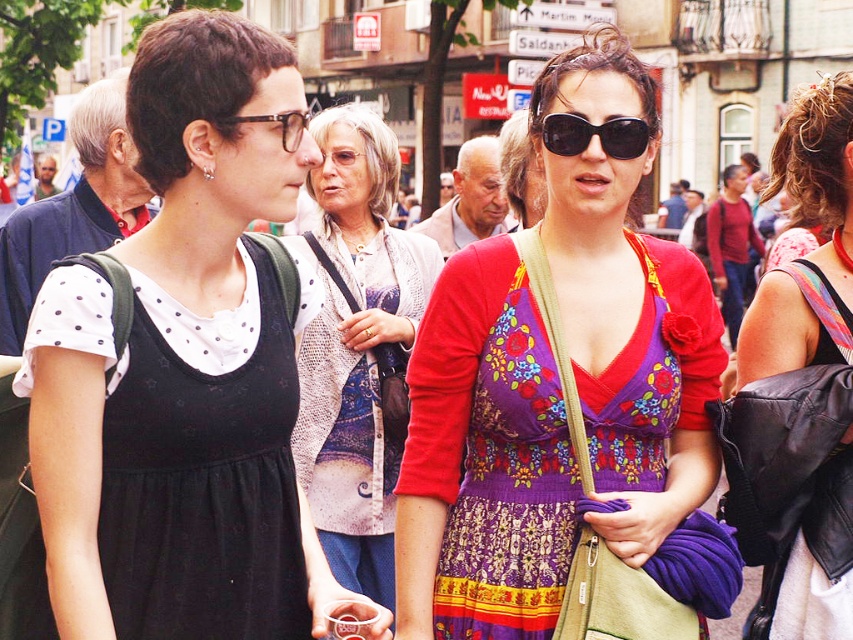
Question: Which object is positioned farthest from the matte black glasses at upper center?

Choices:
 (A) black jersey dress at left
 (B) vibrant floral dress at center
 (C) black plastic sunglasses at center
 (D) printed fabric sweater at center

Answer: (D)

Question: Which point is closer to the camera taking this photo?

Choices:
 (A) (577, 536)
 (B) (799, 582)
 (C) (241, 365)

Answer: (C)

Question: Can you confirm if black plastic sunglasses at center is positioned below matte black glasses at upper center?

Choices:
 (A) no
 (B) yes

Answer: (A)

Question: Which object is closer to the camera taking this photo?

Choices:
 (A) matte black glasses at upper center
 (B) multicolored floral dress at center
 (C) vibrant floral dress at center
 (D) black jersey dress at left

Answer: (D)

Question: Is vibrant floral dress at center smaller than matte black glasses at upper center?

Choices:
 (A) yes
 (B) no

Answer: (B)

Question: Does vibrant floral dress at center have a greater width compared to black jersey dress at left?

Choices:
 (A) yes
 (B) no

Answer: (A)